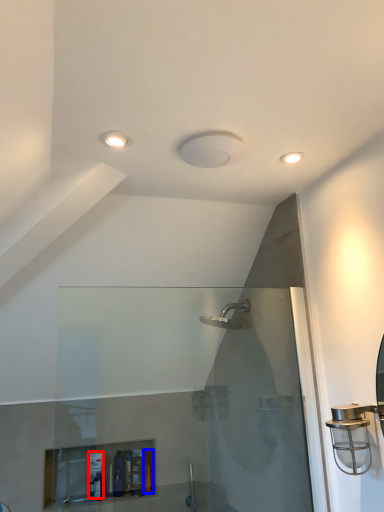
Question: Which of the following is the farthest to the observer, toiletry (highlighted by a red box) or toiletry (highlighted by a blue box)?

Choices:
 (A) toiletry
 (B) toiletry

Answer: (B)